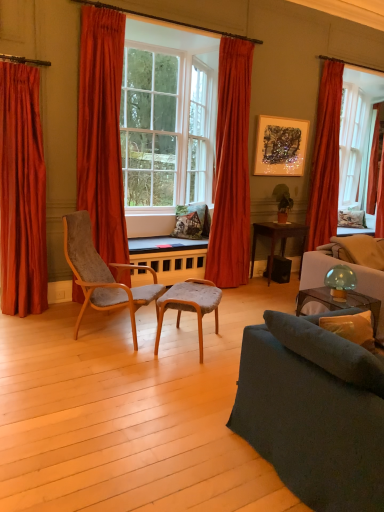
Find the location of a particular element. The height and width of the screenshot is (512, 384). vacant space underneath velvet grey chair at center, marked as the 1th chair in a right-to-left arrangement (from a real-world perspective) is located at coordinates (180, 342).